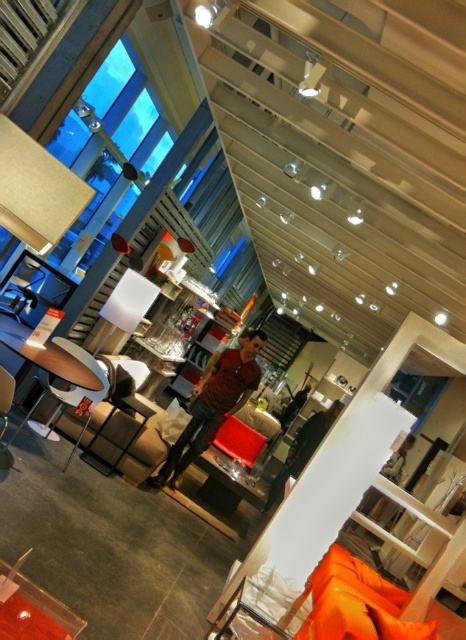
Question: Considering the relative positions of orange fabric couch at lower right and orange fabric pillow at lower right in the image provided, where is orange fabric couch at lower right located with respect to orange fabric pillow at lower right?

Choices:
 (A) left
 (B) right

Answer: (A)

Question: Which of the following is the farthest from the observer?

Choices:
 (A) (378, 634)
 (B) (376, 608)
 (C) (31, 348)

Answer: (B)

Question: Does matte wood table at lower left have a lesser width compared to orange fabric pillow at lower right?

Choices:
 (A) no
 (B) yes

Answer: (A)

Question: Considering the real-world distances, which object is closest to the orange fabric couch at lower right?

Choices:
 (A) matte black armchair at lower left
 (B) orange fabric pillow at lower right

Answer: (B)

Question: Is orange fabric couch at lower right positioned before matte black armchair at center?

Choices:
 (A) no
 (B) yes

Answer: (B)

Question: Among these objects, which one is nearest to the camera?

Choices:
 (A) orange fabric couch at lower right
 (B) orange fabric pillow at lower right
 (C) matte black armchair at lower left

Answer: (A)